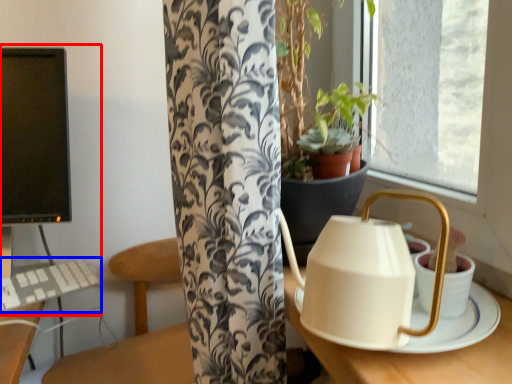
Question: Which object is further to the camera taking this photo, desktop computer (highlighted by a red box) or keyboard (highlighted by a blue box)?

Choices:
 (A) desktop computer
 (B) keyboard

Answer: (A)